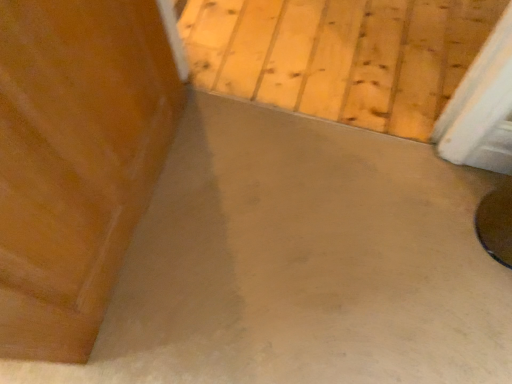
Question: From the image's perspective, relative to smooth concrete floor at center, is shiny brown table at lower right above or below?

Choices:
 (A) above
 (B) below

Answer: (B)

Question: Is shiny brown table at lower right situated inside smooth concrete floor at center or outside?

Choices:
 (A) outside
 (B) inside

Answer: (A)

Question: Is shiny brown table at lower right wider or thinner than smooth concrete floor at center?

Choices:
 (A) wide
 (B) thin

Answer: (B)

Question: In terms of height, does smooth concrete floor at center look taller or shorter compared to shiny brown table at lower right?

Choices:
 (A) tall
 (B) short

Answer: (B)

Question: Is point (481, 6) closer or farther from the camera than point (500, 241)?

Choices:
 (A) closer
 (B) farther

Answer: (B)

Question: Looking at the image, does smooth concrete floor at center seem bigger or smaller compared to shiny brown table at lower right?

Choices:
 (A) big
 (B) small

Answer: (A)

Question: From a real-world perspective, is smooth concrete floor at center above or below shiny brown table at lower right?

Choices:
 (A) below
 (B) above

Answer: (A)